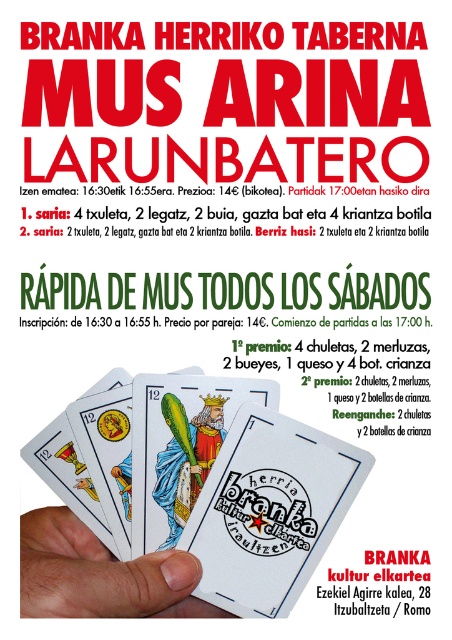
What is the relationship between the sizes of the matte plastic playing card at center and the white paper card at center in the image?

The matte plastic playing card at center is larger in size than the white paper card at center.